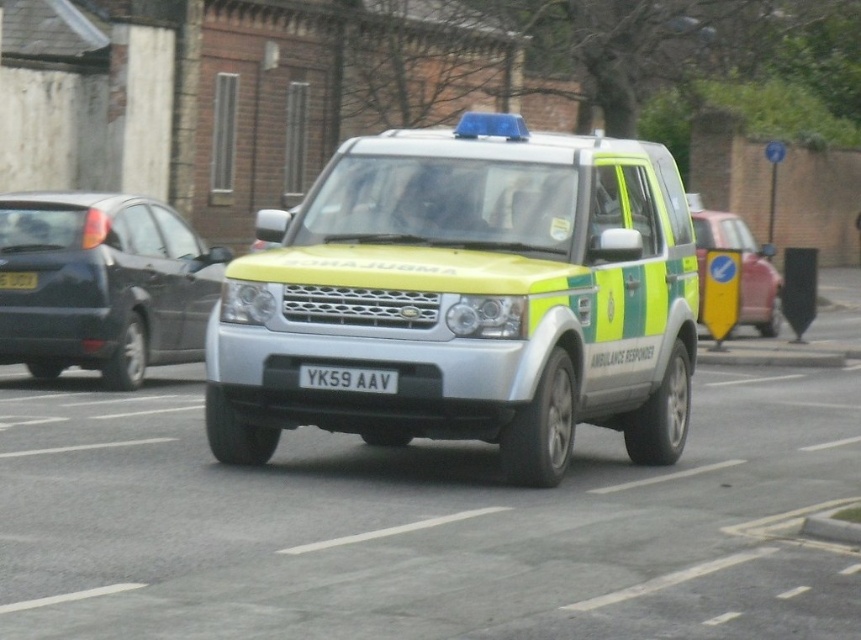
You are a traffic officer observing a metallic silver ambulance at center and a yellow matte license plate at center. Which object takes up more space in the image?

The metallic silver ambulance at center is bigger than the yellow matte license plate at center, so it takes up more space in the image.